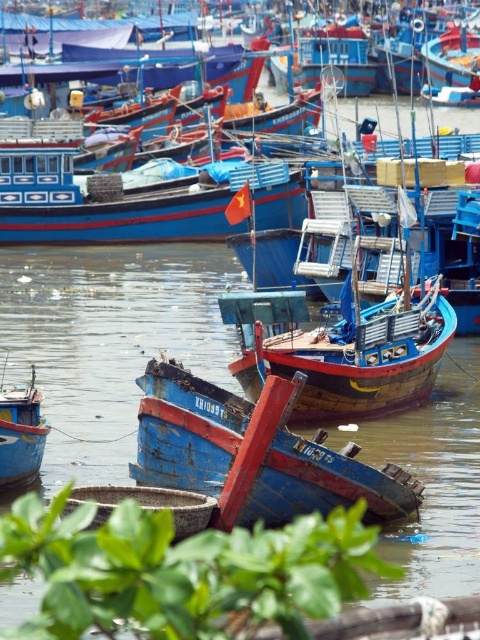
You are standing on the dock and see the blue wooden boat at center and the blue wooden boat at lower left. Which boat is positioned lower in the scene?

The blue wooden boat at center is positioned lower than the blue wooden boat at lower left, so the blue wooden boat at center is lower in the scene.

You are a marine biologist observing the harbor. You need to board a boat for a quick survey. Which boat between the blue wooden boat at center and the blue wooden boat at lower left would you choose if you need more space for your equipment?

The blue wooden boat at center has a larger size compared to the blue wooden boat at lower left, so you should choose the blue wooden boat at center for more space to store your equipment.

You are a photographer standing at the edge of the harbor. You want to take a photo that includes both the blue wooden boat at center and the blue wooden boat at lower left. Which boat should you position closer to the camera to ensure both are in focus?

You should position the blue wooden boat at center closer to the camera because it is already closer to the viewer than the blue wooden boat at lower left, so keeping it nearer will help maintain focus on both boats.